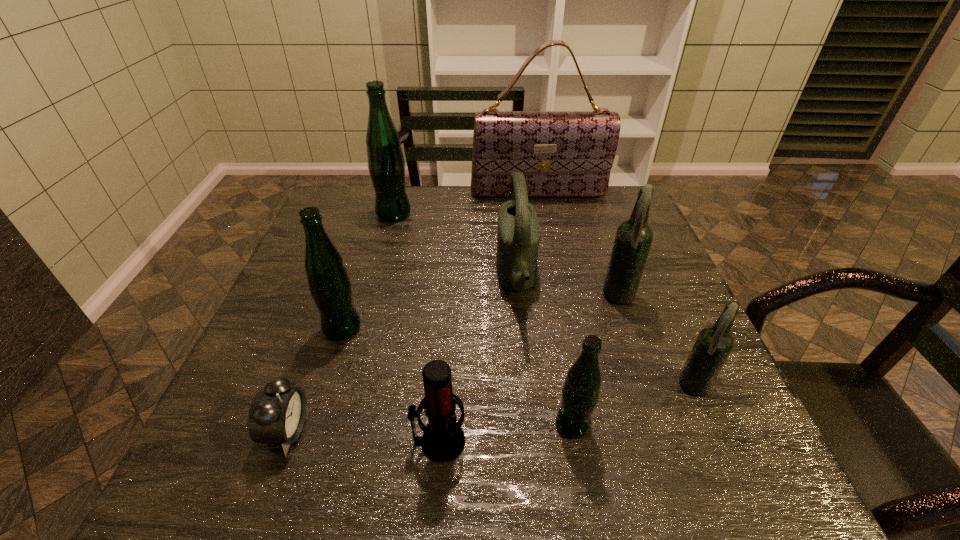
This screenshot has width=960, height=540. What are the coordinates of `the nearest beer bottle` in the screenshot? It's located at pos(580,393).

Identify the location of the nearest green beer bottle. The width and height of the screenshot is (960, 540). (580, 393).

At what (x,y) coordinates should I click in order to perform the action: click on microphone. Please return your answer as a coordinate pair (x, y). This screenshot has width=960, height=540. Looking at the image, I should click on (443, 440).

At what (x,y) coordinates should I click in order to perform the action: click on the shortest object. Please return your answer as a coordinate pair (x, y). Looking at the image, I should click on (277, 415).

This screenshot has height=540, width=960. Identify the location of vacant space situated 0.120m on the front of the tallest object with the clasp. (544, 225).

Locate an element on the screen. The height and width of the screenshot is (540, 960). free spot located 0.080m on the right of the farthest green beer bottle is located at coordinates (438, 214).

Locate an element on the screen. vacant space situated 0.400m on the back of the farther dark beer bottle is located at coordinates (586, 199).

Locate an element on the screen. Image resolution: width=960 pixels, height=540 pixels. vacant region located 0.180m on the front of the second nearest green beer bottle is located at coordinates (314, 418).

I want to click on free region located 0.160m on the spout of the green watering can, so click(432, 278).

Where is `vacant region located on the spout of the green watering can`? This screenshot has width=960, height=540. vacant region located on the spout of the green watering can is located at coordinates (468, 278).